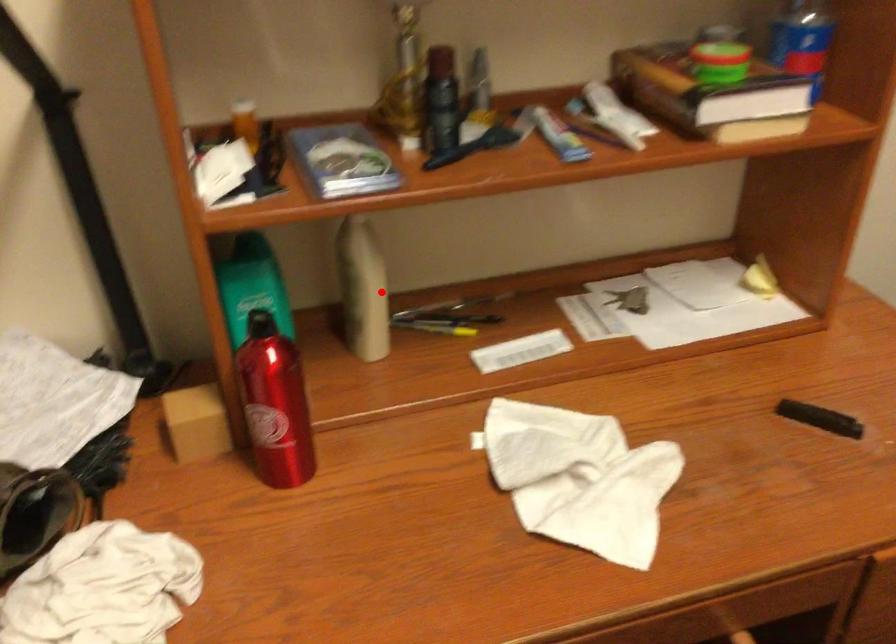
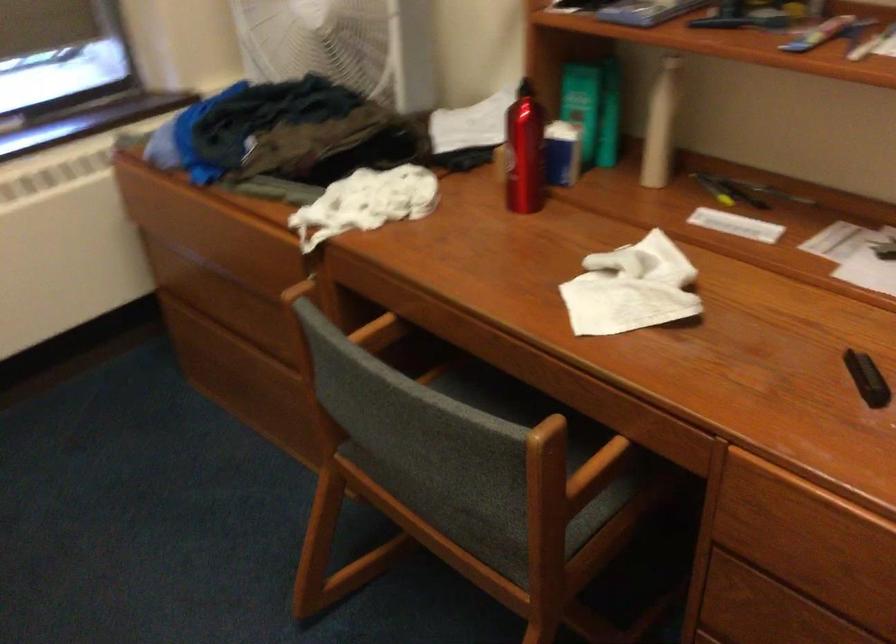
In the second image, find the point that corresponds to the highlighted location in the first image.

(659, 125)